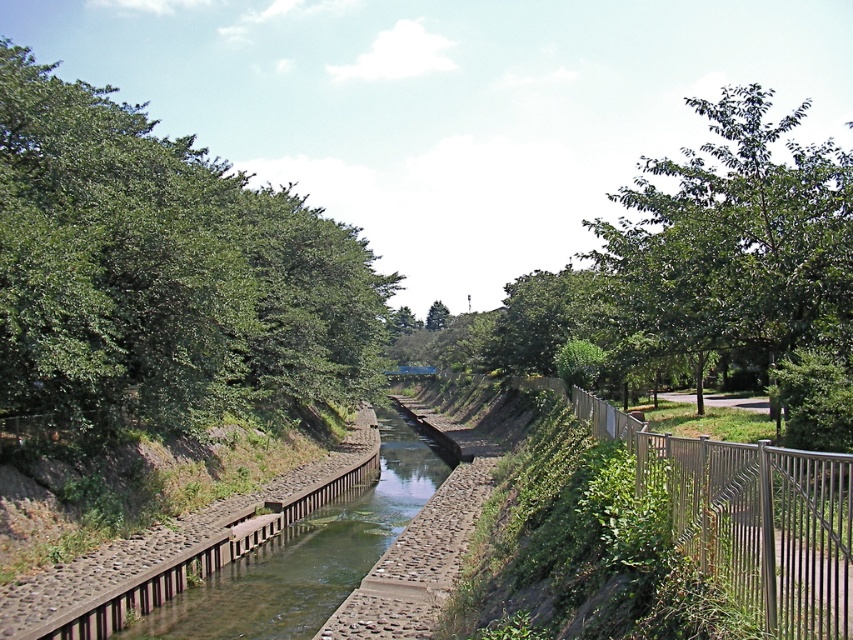
Question: Which object appears farthest from the camera in this image?

Choices:
 (A) green leafy tree at center
 (B) metallic silver fence at right
 (C) green leafy tree at upper right
 (D) green leafy tree at left

Answer: (A)

Question: Considering the real-world distances, which object is closest to the green leafy tree at upper right?

Choices:
 (A) metallic silver fence at right
 (B) green leafy tree at left
 (C) green leafy tree at center

Answer: (B)

Question: Can you confirm if green leafy tree at upper right is thinner than metallic silver fence at right?

Choices:
 (A) yes
 (B) no

Answer: (B)

Question: Which of the following is the closest to the observer?

Choices:
 (A) (848, 627)
 (B) (51, 404)
 (C) (431, 323)

Answer: (A)

Question: Is green leafy tree at left to the left of metallic silver fence at right from the viewer's perspective?

Choices:
 (A) no
 (B) yes

Answer: (B)

Question: Is green leafy tree at left closer to the viewer compared to green leafy tree at upper right?

Choices:
 (A) no
 (B) yes

Answer: (A)